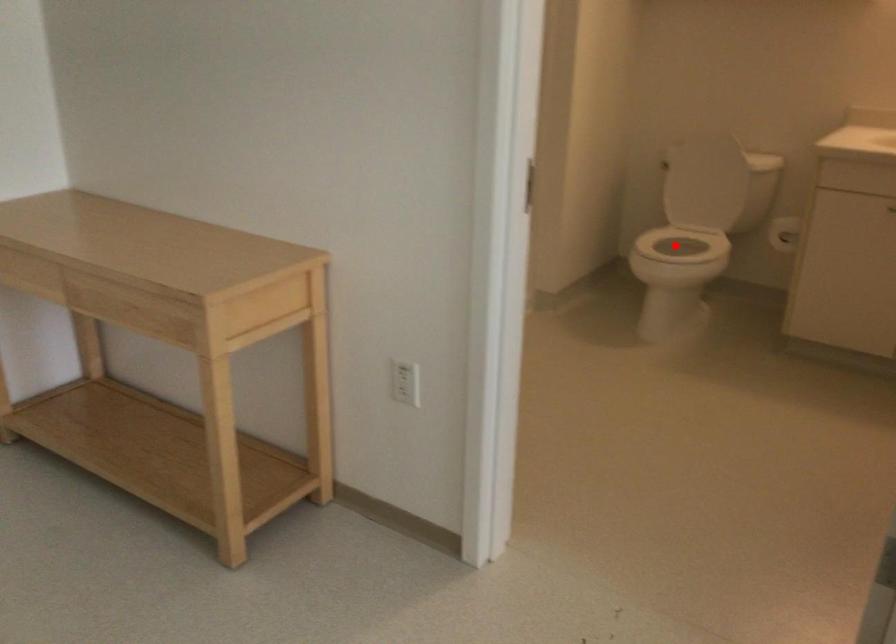
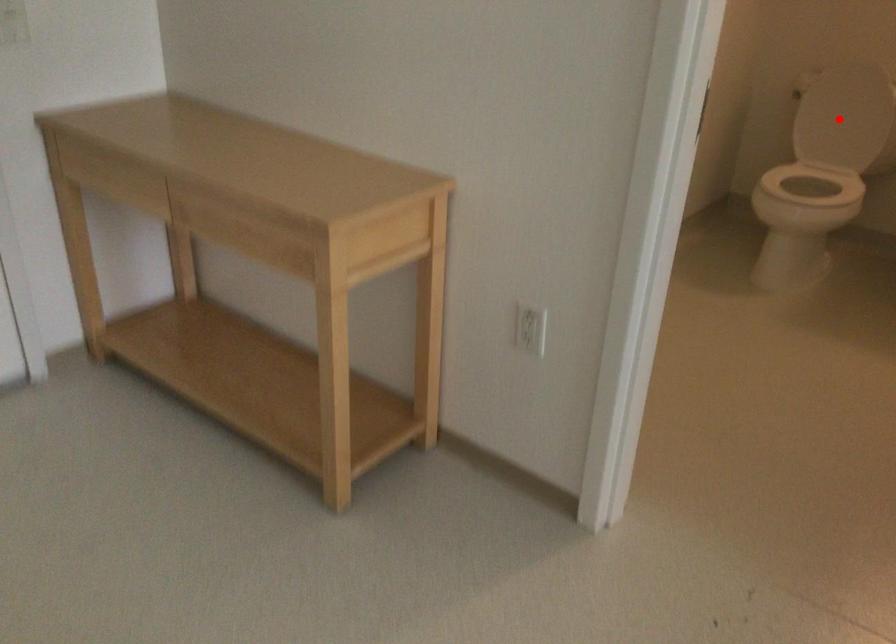
I am providing you with two images of the same scene from different viewpoints. A red point is marked on the first image and another point is marked on the second image. Does the point marked in image1 correspond to the same location as the one in image2?

No